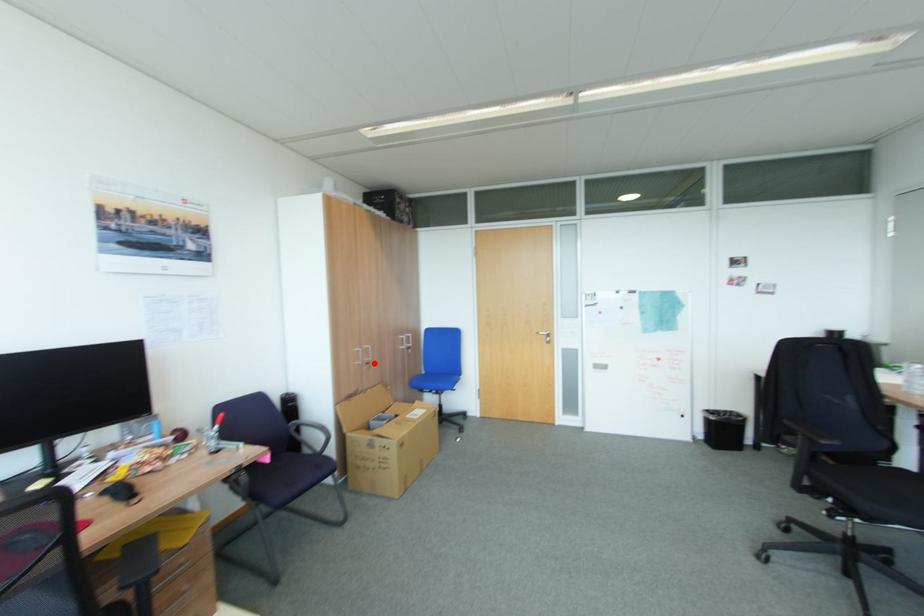
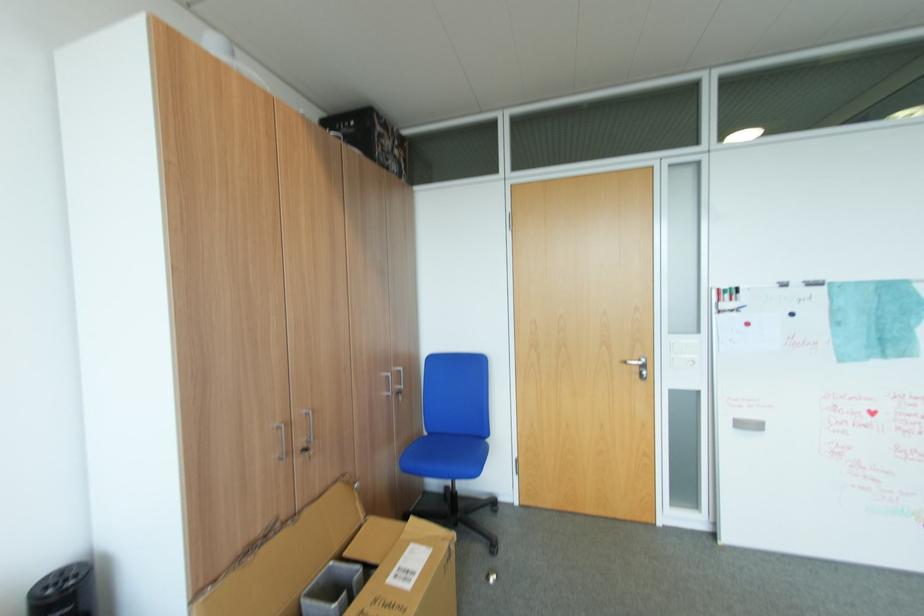
Find the pixel in the second image that matches the highlighted location in the first image.

(310, 451)